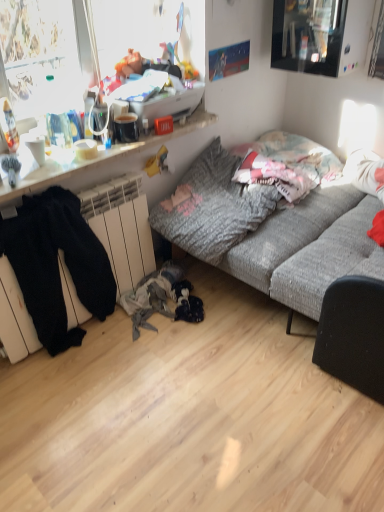
What is the approximate width of white glossy bowl at upper left?

It is 2.48 inches.

The height and width of the screenshot is (512, 384). In order to click on white glossy bowl at upper left in this screenshot , I will do `click(86, 149)`.

Is gray textured pillow at center taller or shorter than black cotton pants at lower left?

In the image, gray textured pillow at center appears to be shorter than black cotton pants at lower left.

Can you confirm if gray textured pillow at center is positioned to the left of black cotton pants at lower left?

No, gray textured pillow at center is not to the left of black cotton pants at lower left.

Is gray textured pillow at center oriented towards black cotton pants at lower left?

No, gray textured pillow at center is not oriented towards black cotton pants at lower left.

From a real-world perspective, is gray textured pillow at center positioned above or below black cotton pants at lower left?

From a real-world perspective, gray textured pillow at center is physically above black cotton pants at lower left.

Which is correct: gray textured pillow at center is inside white glossy bowl at upper left, or outside of it?

The correct answer is: outside.

Which object is positioned more to the left, gray textured pillow at center or white glossy bowl at upper left?

white glossy bowl at upper left is more to the left.

Between gray textured pillow at center and white glossy bowl at upper left, which one has larger width?

gray textured pillow at center is wider.

Looking at this image, would you say textured gray couch at center is inside or outside wooden desk at upper left?

textured gray couch at center is not enclosed by wooden desk at upper left.

Does textured gray couch at center have a greater height compared to wooden desk at upper left?

Yes, textured gray couch at center is taller than wooden desk at upper left.

Can you tell me how much textured gray couch at center and wooden desk at upper left differ in facing direction?

The angle between the facing direction of textured gray couch at center and the facing direction of wooden desk at upper left is 1.24 degrees.

Is textured gray couch at center directly adjacent to wooden desk at upper left?

No.

Is black cotton pants at lower left at the back of textured gray couch at center?

No, textured gray couch at center is not facing away from black cotton pants at lower left.

Considering the positions of objects textured gray couch at center and black cotton pants at lower left in the image provided, who is more to the right, textured gray couch at center or black cotton pants at lower left?

Positioned to the right is textured gray couch at center.

Which object is closer to the camera taking this photo, textured gray couch at center or black cotton pants at lower left?

textured gray couch at center is closer to the camera.

Is point (249, 241) less distant than point (68, 268)?

No, it is not.

Measure the distance from wooden desk at upper left to white glossy bowl at upper left.

The distance of wooden desk at upper left from white glossy bowl at upper left is 8.01 inches.

Is wooden desk at upper left oriented towards white glossy bowl at upper left?

No, wooden desk at upper left is not turned towards white glossy bowl at upper left.

Are wooden desk at upper left and white glossy bowl at upper left making contact?

wooden desk at upper left and white glossy bowl at upper left are not in contact.

From the picture: Considering the relative sizes of wooden desk at upper left and white glossy bowl at upper left in the image provided, is wooden desk at upper left taller than white glossy bowl at upper left?

Incorrect, the height of wooden desk at upper left is not larger of that of white glossy bowl at upper left.

Based on their positions, is white glossy bowl at upper left located to the left or right of textured gray couch at center?

Based on their positions, white glossy bowl at upper left is located to the left of textured gray couch at center.

From the picture: Is white glossy bowl at upper left wider than textured gray couch at center?

Incorrect, the width of white glossy bowl at upper left does not surpass that of textured gray couch at center.

Is white glossy bowl at upper left not near textured gray couch at center?

No, there isn't a large distance between white glossy bowl at upper left and textured gray couch at center.

From the picture: Is white glossy bowl at upper left completely or partially outside of textured gray couch at center?

Indeed, white glossy bowl at upper left is completely outside textured gray couch at center.

Would you say wooden desk at upper left is a long distance from textured gray couch at center?

No, wooden desk at upper left is not far away from textured gray couch at center.

Can you confirm if wooden desk at upper left is positioned to the right of textured gray couch at center?

No.

From a real-world perspective, which is physically below, wooden desk at upper left or textured gray couch at center?

textured gray couch at center is physically lower.

Would you say wooden desk at upper left is inside or outside textured gray couch at center?

wooden desk at upper left is spatially situated outside textured gray couch at center.

Where is `pillow above the black cotton pants at lower left (from the image's perspective)`? Image resolution: width=384 pixels, height=512 pixels. pillow above the black cotton pants at lower left (from the image's perspective) is located at coordinates (212, 207).

Locate an element on the screen. The height and width of the screenshot is (512, 384). bowl above the gray textured pillow at center (from a real-world perspective) is located at coordinates coord(86,149).

Estimate the real-world distances between objects in this image. Which object is further from black cotton pants at lower left, gray textured pillow at center or textured gray couch at center?

Based on the image, textured gray couch at center appears to be further to black cotton pants at lower left.

Which object lies nearer to the anchor point textured gray couch at center, gray textured pillow at center or wooden desk at upper left?

gray textured pillow at center is closer to textured gray couch at center.

Considering their positions, is gray textured pillow at center positioned further to textured gray couch at center than black cotton pants at lower left?

Among the two, black cotton pants at lower left is located further to textured gray couch at center.

Estimate the real-world distances between objects in this image. Which object is closer to black cotton pants at lower left, textured gray couch at center or gray textured pillow at center?

gray textured pillow at center is closer to black cotton pants at lower left.

Based on their spatial positions, is textured gray couch at center or black cotton pants at lower left further from white glossy bowl at upper left?

textured gray couch at center is positioned further to the anchor white glossy bowl at upper left.

Estimate the real-world distances between objects in this image. Which object is further from white glossy bowl at upper left, textured gray couch at center or wooden desk at upper left?

textured gray couch at center.

Based on the photo, estimate the real-world distances between objects in this image. Which object is further from gray textured pillow at center, wooden desk at upper left or white glossy bowl at upper left?

white glossy bowl at upper left.

When comparing their distances from gray textured pillow at center, does textured gray couch at center or black cotton pants at lower left seem closer?

textured gray couch at center is positioned closer to the anchor gray textured pillow at center.

Locate an element on the screen. pillow between black cotton pants at lower left and textured gray couch at center in the horizontal direction is located at coordinates (212, 207).

You are a GUI agent. You are given a task and a screenshot of the screen. Output one action in this format:
    pyautogui.click(x=<x>, y=<y>)
    Task: Click on the desk located between black cotton pants at lower left and gray textured pillow at center in the left-right direction
    
    Given the screenshot: What is the action you would take?
    pyautogui.click(x=98, y=162)

Image resolution: width=384 pixels, height=512 pixels. I want to click on desk situated between white glossy bowl at upper left and gray textured pillow at center from left to right, so click(x=98, y=162).

The width and height of the screenshot is (384, 512). What are the coordinates of `bowl between wooden desk at upper left and black cotton pants at lower left in the vertical direction` in the screenshot? It's located at (86, 149).